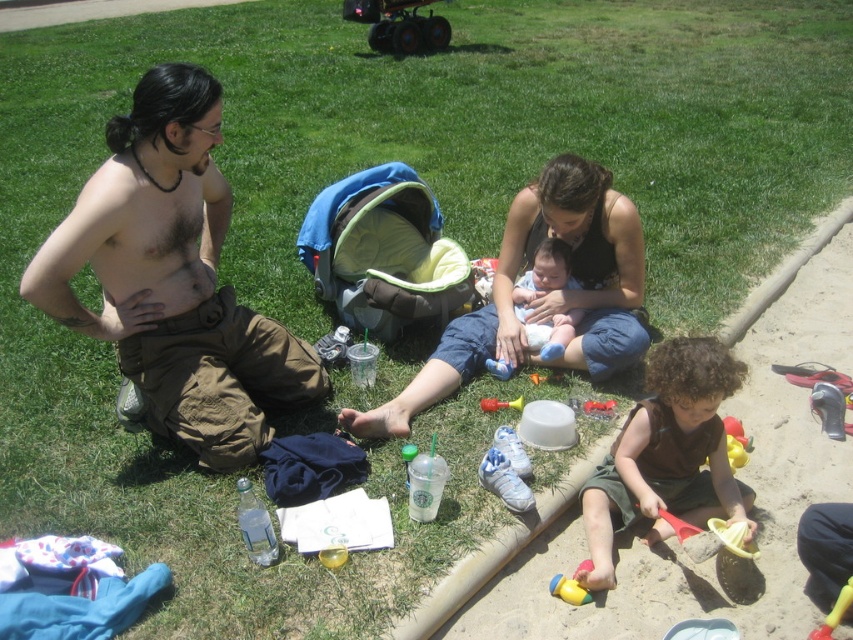
You are a parent trying to find your baby in the image. You see the hairy skin at center and the light blue fabric baby at center. Which one is closer to the top of the image?

The hairy skin at center is above the light blue fabric baby at center, so it is closer to the top of the image.

What are the coordinates of the yellow plastic toy at lower center?

The yellow plastic toy at lower center is located at coordinates point (567, 589).